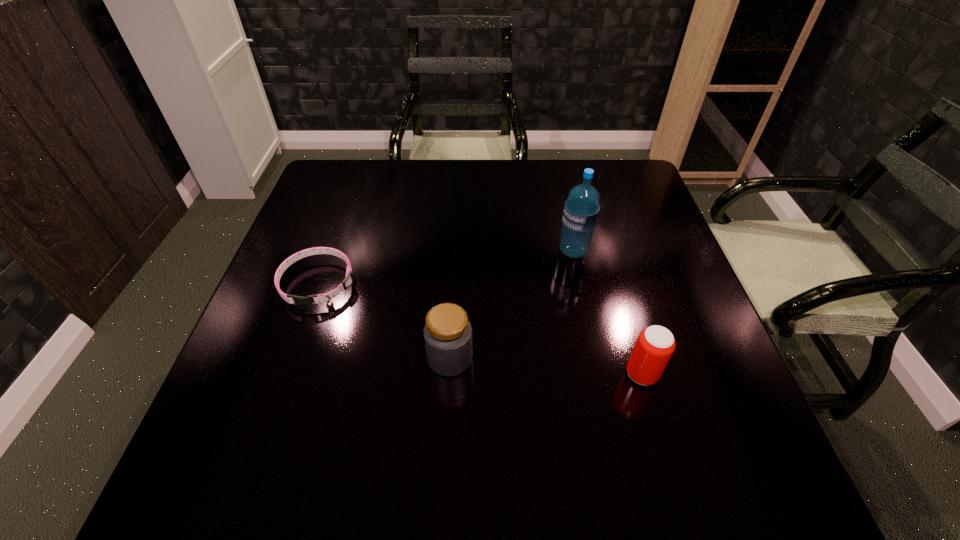
Find the location of `object at the left edge`. object at the left edge is located at coordinates (346, 283).

This screenshot has width=960, height=540. In order to click on object present at the right edge in this screenshot , I will do `click(655, 345)`.

Find the location of `free space at the far edge of the desktop`. free space at the far edge of the desktop is located at coordinates (546, 165).

This screenshot has width=960, height=540. In order to click on free region at the near edge of the desktop in this screenshot , I will do `click(554, 497)`.

The width and height of the screenshot is (960, 540). In order to click on vacant space at the left edge in this screenshot , I will do `click(296, 273)`.

Locate an element on the screen. The image size is (960, 540). vacant space at the right edge of the desktop is located at coordinates (689, 328).

Find the location of a particular element. vacant space at the far left corner of the desktop is located at coordinates (360, 192).

Identify the location of vacant space at the near left corner. (222, 477).

The image size is (960, 540). I want to click on blank space at the far right corner, so click(593, 165).

Identify the location of free region at the near right corner of the desktop. The image size is (960, 540). (678, 443).